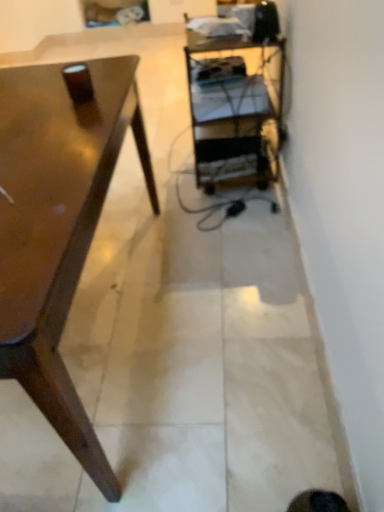
Question: Is glossy wood desk at left wider or thinner than metallic silver shelf at center?

Choices:
 (A) wide
 (B) thin

Answer: (A)

Question: In the image, is glossy wood desk at left positioned in front of or behind metallic silver shelf at center?

Choices:
 (A) behind
 (B) front

Answer: (B)

Question: From a real-world perspective, relative to metallic silver shelf at center, is glossy wood desk at left vertically above or below?

Choices:
 (A) above
 (B) below

Answer: (A)

Question: Is point coord(284,42) positioned closer to the camera than point coord(64,397)?

Choices:
 (A) farther
 (B) closer

Answer: (A)

Question: Is metallic silver shelf at center wider or thinner than glossy wood desk at left?

Choices:
 (A) wide
 (B) thin

Answer: (B)

Question: Considering their positions, is metallic silver shelf at center located in front of or behind glossy wood desk at left?

Choices:
 (A) front
 (B) behind

Answer: (B)

Question: Is metallic silver shelf at center taller or shorter than glossy wood desk at left?

Choices:
 (A) tall
 (B) short

Answer: (A)